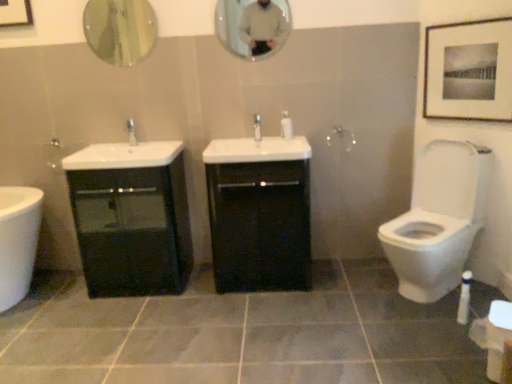
Describe the element at coordinates (260, 225) in the screenshot. The height and width of the screenshot is (384, 512). I see `black glossy cabinet at center, which is counted as the 2th bathroom cabinet, starting from the left` at that location.

The image size is (512, 384). What do you see at coordinates (253, 27) in the screenshot? I see `matte glass mirror at upper center, which appears as the 2th mirror when viewed from the left` at bounding box center [253, 27].

The image size is (512, 384). Identify the location of matte silver faucet at center, which ranks as the 2th tap in right-to-left order. (131, 132).

Identify the location of white glossy tap at center, the first tap in the right-to-left sequence. (257, 127).

Could you measure the distance between black glossy cabinet at center, the first bathroom cabinet when ordered from right to left, and matte silver faucet at center, the first tap when ordered from left to right?

39.22 inches.

Is black glossy cabinet at center, the first bathroom cabinet when ordered from right to left, not close to matte silver faucet at center, which ranks as the 2th tap in right-to-left order?

No.

From a real-world perspective, does black glossy cabinet at center, which is counted as the 2th bathroom cabinet, starting from the left, stand above matte silver faucet at center, which ranks as the 2th tap in right-to-left order?

No, from a real-world perspective, black glossy cabinet at center, which is counted as the 2th bathroom cabinet, starting from the left, is not above matte silver faucet at center, which ranks as the 2th tap in right-to-left order.

From a real-world perspective, count 2nd taps upward from the black glossy cabinet at center, the first bathroom cabinet when ordered from right to left, and point to it. Please provide its 2D coordinates.

[(131, 132)]

Considering the relative sizes of matte white shower at upper center and white glossy tap at center, the 2th tap positioned from the left, in the image provided, is matte white shower at upper center bigger than white glossy tap at center, the 2th tap positioned from the left,?

No.

Considering the sizes of objects matte white shower at upper center and white glossy tap at center, the 2th tap positioned from the left, in the image provided, who is thinner, matte white shower at upper center or white glossy tap at center, the 2th tap positioned from the left,?

Thinner between the two is matte white shower at upper center.

Looking at this image, would you consider matte white shower at upper center to be distant from white glossy tap at center, the 2th tap positioned from the left?

matte white shower at upper center is actually quite close to white glossy tap at center, the 2th tap positioned from the left.

Would you say matte white shower at upper center is outside white glossy tap at center, the 2th tap positioned from the left?

Yes, matte white shower at upper center is not within white glossy tap at center, the 2th tap positioned from the left.

Is matte white shower at upper center oriented away from metallic circular mirror at upper left, arranged as the second mirror when viewed from the right?

matte white shower at upper center is not turned away from metallic circular mirror at upper left, arranged as the second mirror when viewed from the right.

Considering the positions of points (351, 133) and (134, 0), is point (351, 133) closer to camera compared to point (134, 0)?

No, it is not.

In the scene shown: From a real-world perspective, is matte white shower at upper center under metallic circular mirror at upper left, which is the first mirror in left-to-right order?

Yes, from a real-world perspective, matte white shower at upper center is under metallic circular mirror at upper left, which is the first mirror in left-to-right order.

The image size is (512, 384). What are the coordinates of `shower below the metallic circular mirror at upper left, which is the first mirror in left-to-right order (from a real-world perspective)` in the screenshot? It's located at tap(341, 138).

Is point (468, 54) closer to camera compared to point (129, 132)?

Yes, point (468, 54) is closer to viewer.

From the image's perspective, relative to matte silver faucet at center, which ranks as the 2th tap in right-to-left order, is matte black picture frame at upper right above or below?

matte black picture frame at upper right is above matte silver faucet at center, which ranks as the 2th tap in right-to-left order.

Consider the image. Is matte black picture frame at upper right looking in the opposite direction of matte silver faucet at center, the first tap when ordered from left to right?

No, matte black picture frame at upper right is not facing away from matte silver faucet at center, the first tap when ordered from left to right.

Does matte black picture frame at upper right touch matte silver faucet at center, which ranks as the 2th tap in right-to-left order?

No, matte black picture frame at upper right is not beside matte silver faucet at center, which ranks as the 2th tap in right-to-left order.

Which of these two, white glossy tap at center, the first tap in the right-to-left sequence, or black glossy cabinet at center, which is counted as the 2th bathroom cabinet, starting from the left, is bigger?

With larger size is black glossy cabinet at center, which is counted as the 2th bathroom cabinet, starting from the left.

Where is `tap that is the 1st object to the left of the black glossy cabinet at center, the first bathroom cabinet when ordered from right to left, starting at the anchor`? The image size is (512, 384). tap that is the 1st object to the left of the black glossy cabinet at center, the first bathroom cabinet when ordered from right to left, starting at the anchor is located at coordinates (257, 127).

Is white glossy tap at center, the first tap in the right-to-left sequence, touching black glossy cabinet at center, which is counted as the 2th bathroom cabinet, starting from the left?

white glossy tap at center, the first tap in the right-to-left sequence, and black glossy cabinet at center, which is counted as the 2th bathroom cabinet, starting from the left, are clearly separated.

Is point (253, 125) in front of point (210, 205)?

No, it is behind (210, 205).

Considering the positions of objects matte white shower at upper center and white glossy toilet at right in the image provided, who is more to the left, matte white shower at upper center or white glossy toilet at right?

Positioned to the left is matte white shower at upper center.

Does point (341, 133) come behind point (433, 221)?

That is True.

Who is bigger, matte white shower at upper center or white glossy toilet at right?

Bigger between the two is white glossy toilet at right.

Is white glossy tap at center, the first tap in the right-to-left sequence, oriented towards matte white shower at upper center?

No, white glossy tap at center, the first tap in the right-to-left sequence, is not oriented towards matte white shower at upper center.

In the image, is white glossy tap at center, the 2th tap positioned from the left, on the left side or the right side of matte white shower at upper center?

From the image, it's evident that white glossy tap at center, the 2th tap positioned from the left, is to the left of matte white shower at upper center.

From the image's perspective, which object appears higher, white glossy tap at center, the first tap in the right-to-left sequence, or matte white shower at upper center?

white glossy tap at center, the first tap in the right-to-left sequence, is shown above in the image.

Looking at this image, from a real-world perspective, which object stands above the other?

From a 3D spatial view, white glossy tap at center, the 2th tap positioned from the left, is above.

Locate an element on the screen. The width and height of the screenshot is (512, 384). the 2nd tap directly above the black glossy cabinet at center, the first bathroom cabinet when ordered from right to left (from a real-world perspective) is located at coordinates [131, 132].

Identify the location of tap that is the 2nd one when counting forward from the matte white shower at upper center. (257, 127).

When comparing their distances from white glossy soap dispenser at center, does gray matte tile at center or black glossy cabinet at left, which appears as the second bathroom cabinet when viewed from the right, seem further?

gray matte tile at center lies further to white glossy soap dispenser at center than the other object.

From the image, which object appears to be farther from white glossy soap dispenser at center, matte black picture frame at upper right or gray matte tile at center?

gray matte tile at center is positioned further to the anchor white glossy soap dispenser at center.

Which object lies nearer to the anchor point matte glass mirror at upper center, which appears as the 2th mirror when viewed from the left, matte white shower at upper center or white plastic toothbrush at lower right?

The object closer to matte glass mirror at upper center, which appears as the 2th mirror when viewed from the left, is matte white shower at upper center.

Which object lies further to the anchor point white plastic toothbrush at lower right, matte white shower at upper center or metallic circular mirror at upper left, arranged as the second mirror when viewed from the right?

metallic circular mirror at upper left, arranged as the second mirror when viewed from the right, lies further to white plastic toothbrush at lower right than the other object.

Based on the photo, when comparing their distances from matte silver faucet at center, the first tap when ordered from left to right, does white glossy soap dispenser at center or white glossy toilet at right seem further?

white glossy toilet at right is further to matte silver faucet at center, the first tap when ordered from left to right.

From the image, which object appears to be nearer to gray matte tile at center, matte silver faucet at center, the first tap when ordered from left to right, or matte glass mirror at upper center, which appears as the 2th mirror when viewed from the left?

Among the two, matte silver faucet at center, the first tap when ordered from left to right, is located nearer to gray matte tile at center.

Considering their positions, is matte silver faucet at center, which ranks as the 2th tap in right-to-left order, positioned further to matte white shower at upper center than white glossy toilet at right?

matte silver faucet at center, which ranks as the 2th tap in right-to-left order, is further to matte white shower at upper center.

Considering their positions, is matte black picture frame at upper right positioned further to matte white shower at upper center than metallic circular mirror at upper left, which is the first mirror in left-to-right order?

metallic circular mirror at upper left, which is the first mirror in left-to-right order.

The width and height of the screenshot is (512, 384). In order to click on shower that lies between matte glass mirror at upper center, which appears as the 2th mirror when viewed from the left, and white glossy toilet at right from top to bottom in this screenshot , I will do `click(341, 138)`.

You are a GUI agent. You are given a task and a screenshot of the screen. Output one action in this format:
    pyautogui.click(x=<x>, y=<y>)
    Task: Click on the soap dispenser situated between white glossy tap at center, the 2th tap positioned from the left, and white plastic toothbrush at lower right from left to right
    The height and width of the screenshot is (384, 512).
    Given the screenshot: What is the action you would take?
    pyautogui.click(x=286, y=126)

Identify the location of soap dispenser located between white glossy tap at center, the first tap in the right-to-left sequence, and matte white shower at upper center in the left-right direction. This screenshot has width=512, height=384. (286, 126).

Where is `mirror between matte glass mirror at upper center, the first mirror viewed from the right, and black glossy cabinet at center, the first bathroom cabinet when ordered from right to left, in the up-down direction`? The height and width of the screenshot is (384, 512). mirror between matte glass mirror at upper center, the first mirror viewed from the right, and black glossy cabinet at center, the first bathroom cabinet when ordered from right to left, in the up-down direction is located at coordinates (120, 30).